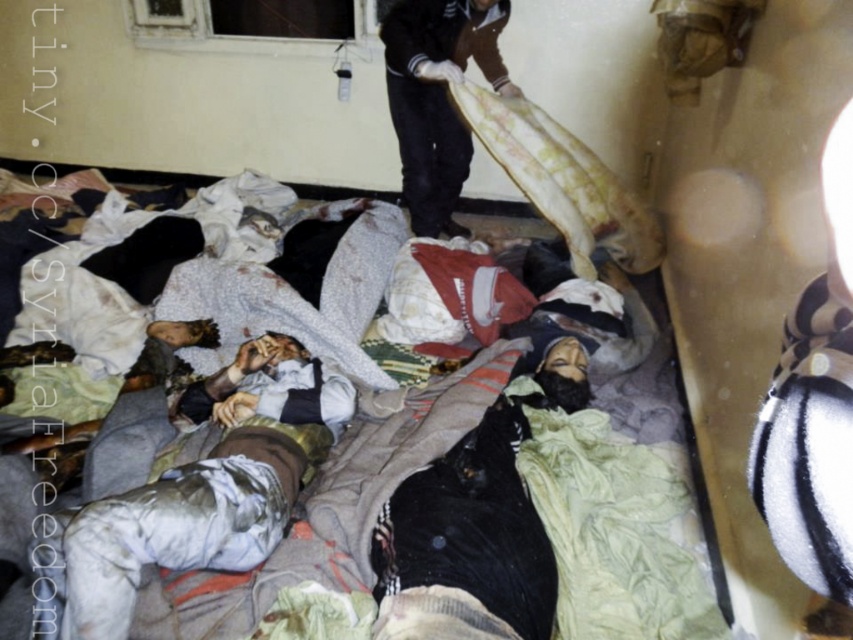
Question: Can you confirm if black cotton shirt at center is positioned above brown cotton shirt at upper center?

Choices:
 (A) no
 (B) yes

Answer: (A)

Question: Which object appears farthest from the camera in this image?

Choices:
 (A) brown cotton shirt at upper center
 (B) white cotton cloth at lower left

Answer: (A)

Question: Does white cotton blanket at center appear over black cotton shirt at center?

Choices:
 (A) no
 (B) yes

Answer: (B)

Question: Which is farther from the brown cotton shirt at upper center?

Choices:
 (A) white cotton cloth at lower left
 (B) black cotton shirt at center

Answer: (A)

Question: Is black cotton shirt at center below white cotton cloth at lower left?

Choices:
 (A) yes
 (B) no

Answer: (B)

Question: Which of the following is the closest to the observer?

Choices:
 (A) pyautogui.click(x=553, y=497)
 (B) pyautogui.click(x=432, y=564)

Answer: (B)